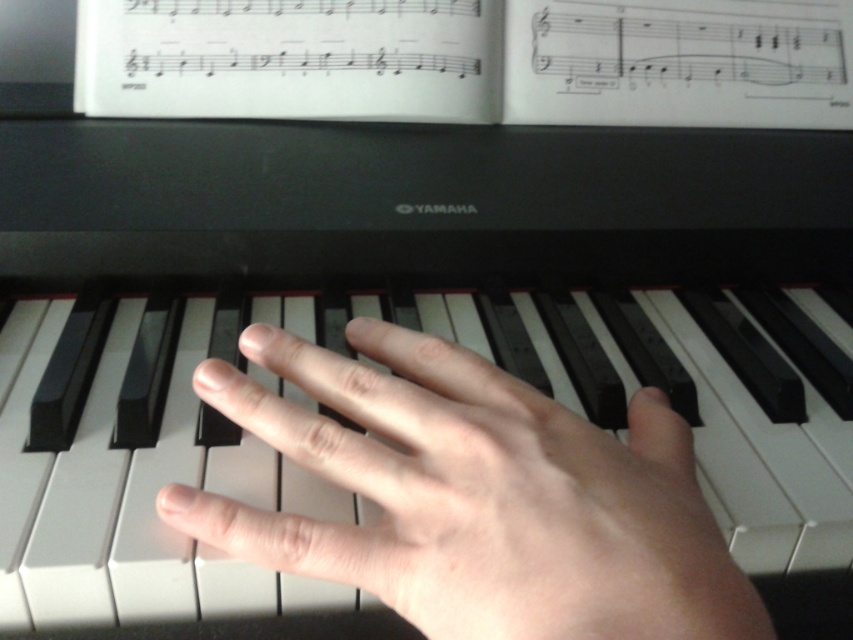
Question: Is smooth skin hand at center smaller than white paper at upper center?

Choices:
 (A) no
 (B) yes

Answer: (B)

Question: Does smooth skin hand at center have a greater width compared to white paper at upper center?

Choices:
 (A) yes
 (B) no

Answer: (B)

Question: Which point is closer to the camera taking this photo?

Choices:
 (A) (88, 106)
 (B) (518, 467)

Answer: (B)

Question: Does smooth skin hand at center appear over white paper at upper center?

Choices:
 (A) yes
 (B) no

Answer: (B)

Question: Which point is closer to the camera?

Choices:
 (A) white paper at upper center
 (B) smooth skin hand at center

Answer: (B)